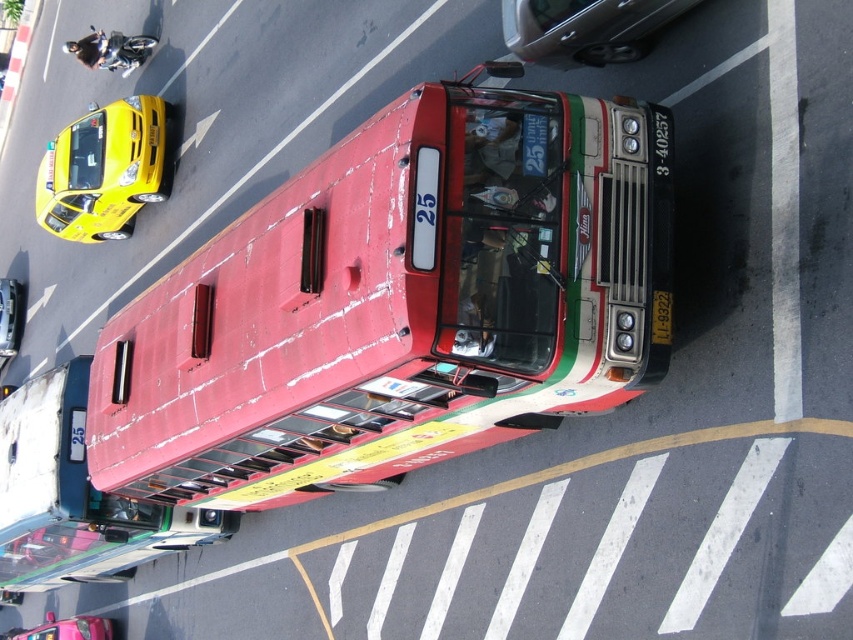
Can you confirm if matte red bus at center is shorter than metallic silver sedan at upper center?

No, matte red bus at center is not shorter than metallic silver sedan at upper center.

Who is positioned more to the right, matte red bus at center or metallic silver sedan at upper center?

Positioned to the right is metallic silver sedan at upper center.

Is point (556, 179) closer to viewer compared to point (598, 22)?

Yes, it is.

Identify the location of matte red bus at center. (398, 301).

Which of these two, matte red bus at center or yellow glossy taxi at upper left, stands shorter?

matte red bus at center is shorter.

Is matte red bus at center bigger than yellow glossy taxi at upper left?

No.

Is point (599, 192) less distant than point (154, 120)?

Yes, it is.

The width and height of the screenshot is (853, 640). What are the coordinates of `matte red bus at center` in the screenshot? It's located at (398, 301).

Can you confirm if rusty metal bus at center is thinner than metallic pink taxi at lower left?

Correct, rusty metal bus at center's width is less than metallic pink taxi at lower left's.

Does rusty metal bus at center have a smaller size compared to metallic pink taxi at lower left?

Indeed, rusty metal bus at center has a smaller size compared to metallic pink taxi at lower left.

The image size is (853, 640). Identify the location of rusty metal bus at center. tap(74, 497).

Where is `rusty metal bus at center`? The width and height of the screenshot is (853, 640). rusty metal bus at center is located at coordinates tap(74, 497).